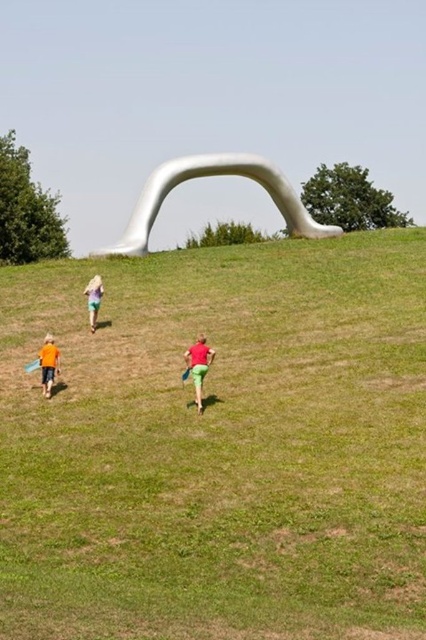
You are a photographer planning to capture a photo of the green grassy field at center and the white matte arch at center. From your current position, which object will appear closer to you in the photo?

The green grassy field at center will appear closer to you in the photo because it is positioned in front of the white matte arch at center.

You are standing in the grassy field and want to walk from point A to point B. Point A is at coordinate point (302, 216) and point B is at coordinate point (100, 298). Which point is closer to you when you start walking?

Point A at coordinate point (302, 216) is closer to you because it is further to the viewer than point B at coordinate point (100, 298).